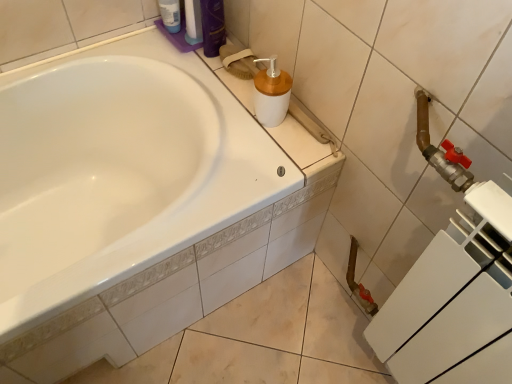
Describe the element at coordinates (271, 93) in the screenshot. The image size is (512, 384). I see `white matte plastic soap dispenser at upper center` at that location.

You are a GUI agent. You are given a task and a screenshot of the screen. Output one action in this format:
    pyautogui.click(x=<x>, y=<y>)
    Task: Click on the translucent plastic bottle at upper left, the second toiletry positioned from the right
    
    Given the screenshot: What is the action you would take?
    pyautogui.click(x=170, y=15)

From the image's perspective, which is above, white matte plastic soap dispenser at upper center or translucent plastic bottle at upper left, the first toiletry when ordered from left to right?

translucent plastic bottle at upper left, the first toiletry when ordered from left to right, is shown above in the image.

Looking at their sizes, would you say white matte plastic soap dispenser at upper center is wider or thinner than translucent plastic bottle at upper left, the first toiletry when ordered from left to right?

Clearly, white matte plastic soap dispenser at upper center has more width compared to translucent plastic bottle at upper left, the first toiletry when ordered from left to right.

Is white matte plastic soap dispenser at upper center to the right of translucent plastic bottle at upper left, the second toiletry positioned from the right, from the viewer's perspective?

Correct, you'll find white matte plastic soap dispenser at upper center to the right of translucent plastic bottle at upper left, the second toiletry positioned from the right.

Consider the image. Is white matte plastic soap dispenser at upper center beside translucent plastic bottle at upper left, the first toiletry when ordered from left to right?

No, white matte plastic soap dispenser at upper center is not making contact with translucent plastic bottle at upper left, the first toiletry when ordered from left to right.

Would you consider white matte plastic soap dispenser at upper center to be distant from shiny purple bottle at upper center, positioned as the second toiletry in left-to-right order?

Actually, white matte plastic soap dispenser at upper center and shiny purple bottle at upper center, positioned as the second toiletry in left-to-right order, are a little close together.

Is white matte plastic soap dispenser at upper center wider than shiny purple bottle at upper center, positioned as the second toiletry in left-to-right order?

Yes, white matte plastic soap dispenser at upper center is wider than shiny purple bottle at upper center, positioned as the second toiletry in left-to-right order.

Is point (260, 79) in front of point (207, 49)?

Yes, it is in front of point (207, 49).

Can you tell me how much white matte plastic soap dispenser at upper center and shiny purple bottle at upper center, positioned as the second toiletry in left-to-right order, differ in facing direction?

The angle between the facing direction of white matte plastic soap dispenser at upper center and the facing direction of shiny purple bottle at upper center, positioned as the second toiletry in left-to-right order, is 0.00205 degrees.

From a real-world perspective, between shiny purple bottle at upper center, which is the 1th toiletry from right to left, and translucent plastic bottle at upper left, the second toiletry positioned from the right, who is vertically lower?

translucent plastic bottle at upper left, the second toiletry positioned from the right.

Could you tell me if shiny purple bottle at upper center, positioned as the second toiletry in left-to-right order, is facing translucent plastic bottle at upper left, the second toiletry positioned from the right?

No, shiny purple bottle at upper center, positioned as the second toiletry in left-to-right order, is not facing towards translucent plastic bottle at upper left, the second toiletry positioned from the right.

Which is closer to the camera, (207, 29) or (174, 20)?

The point (207, 29) is closer.

Is shiny purple bottle at upper center, positioned as the second toiletry in left-to-right order, wider than translucent plastic bottle at upper left, the second toiletry positioned from the right?

Correct, the width of shiny purple bottle at upper center, positioned as the second toiletry in left-to-right order, exceeds that of translucent plastic bottle at upper left, the second toiletry positioned from the right.

Looking at this image, is translucent plastic bottle at upper left, the second toiletry positioned from the right, in front of shiny purple bottle at upper center, which is the 1th toiletry from right to left?

That is False.

Which is more distant, (160, 2) or (206, 29)?

Point (160, 2)

This screenshot has height=384, width=512. What are the coordinates of `toiletry lying behind the shiny purple bottle at upper center, positioned as the second toiletry in left-to-right order` in the screenshot? It's located at (170, 15).

Which of these two, translucent plastic bottle at upper left, the second toiletry positioned from the right, or shiny purple bottle at upper center, positioned as the second toiletry in left-to-right order, is bigger?

Bigger between the two is shiny purple bottle at upper center, positioned as the second toiletry in left-to-right order.

From a real-world perspective, is shiny purple bottle at upper center, positioned as the second toiletry in left-to-right order, below white matte plastic soap dispenser at upper center?

No, from a real-world perspective, shiny purple bottle at upper center, positioned as the second toiletry in left-to-right order, is not beneath white matte plastic soap dispenser at upper center.

Can you confirm if shiny purple bottle at upper center, positioned as the second toiletry in left-to-right order, is wider than white matte plastic soap dispenser at upper center?

No, shiny purple bottle at upper center, positioned as the second toiletry in left-to-right order, is not wider than white matte plastic soap dispenser at upper center.

Is shiny purple bottle at upper center, which is the 1th toiletry from right to left, positioned behind white matte plastic soap dispenser at upper center?

Yes, the depth of shiny purple bottle at upper center, which is the 1th toiletry from right to left, is greater than that of white matte plastic soap dispenser at upper center.

Does shiny purple bottle at upper center, positioned as the second toiletry in left-to-right order, touch white matte plastic soap dispenser at upper center?

shiny purple bottle at upper center, positioned as the second toiletry in left-to-right order, and white matte plastic soap dispenser at upper center are not in contact.

From the image's perspective, is translucent plastic bottle at upper left, the first toiletry when ordered from left to right, beneath white matte plastic soap dispenser at upper center?

Actually, translucent plastic bottle at upper left, the first toiletry when ordered from left to right, appears above white matte plastic soap dispenser at upper center in the image.

Are translucent plastic bottle at upper left, the second toiletry positioned from the right, and white matte plastic soap dispenser at upper center far apart?

No, translucent plastic bottle at upper left, the second toiletry positioned from the right, is not far from white matte plastic soap dispenser at upper center.

Is point (159, 6) positioned after point (260, 90)?

Yes.

Image resolution: width=512 pixels, height=384 pixels. What are the coordinates of `the 2nd toiletry above the white matte plastic soap dispenser at upper center (from the image's perspective)` in the screenshot? It's located at (170, 15).

From the white matte plastic soap dispenser at upper center, count the 1st toiletry to the left and point to it. Please provide its 2D coordinates.

[(213, 26)]

Estimate the real-world distances between objects in this image. Which object is closer to translucent plastic bottle at upper left, the second toiletry positioned from the right, white matte plastic soap dispenser at upper center or shiny purple bottle at upper center, which is the 1th toiletry from right to left?

Among the two, shiny purple bottle at upper center, which is the 1th toiletry from right to left, is located nearer to translucent plastic bottle at upper left, the second toiletry positioned from the right.

Based on their spatial positions, is white matte plastic soap dispenser at upper center or translucent plastic bottle at upper left, the second toiletry positioned from the right, closer to shiny purple bottle at upper center, positioned as the second toiletry in left-to-right order?

translucent plastic bottle at upper left, the second toiletry positioned from the right.

Based on their spatial positions, is shiny purple bottle at upper center, positioned as the second toiletry in left-to-right order, or translucent plastic bottle at upper left, the second toiletry positioned from the right, further from white matte plastic soap dispenser at upper center?

The object further to white matte plastic soap dispenser at upper center is translucent plastic bottle at upper left, the second toiletry positioned from the right.

Considering their positions, is translucent plastic bottle at upper left, the first toiletry when ordered from left to right, positioned further to white matte plastic soap dispenser at upper center than shiny purple bottle at upper center, positioned as the second toiletry in left-to-right order?

translucent plastic bottle at upper left, the first toiletry when ordered from left to right, is positioned further to the anchor white matte plastic soap dispenser at upper center.

Which object lies further to the anchor point translucent plastic bottle at upper left, the second toiletry positioned from the right, shiny purple bottle at upper center, which is the 1th toiletry from right to left, or white matte plastic soap dispenser at upper center?

white matte plastic soap dispenser at upper center.

Looking at the image, which one is located further to shiny purple bottle at upper center, positioned as the second toiletry in left-to-right order, translucent plastic bottle at upper left, the second toiletry positioned from the right, or white matte plastic soap dispenser at upper center?

The object further to shiny purple bottle at upper center, positioned as the second toiletry in left-to-right order, is white matte plastic soap dispenser at upper center.

Find the location of a particular element. The width and height of the screenshot is (512, 384). toiletry between translucent plastic bottle at upper left, the first toiletry when ordered from left to right, and white matte plastic soap dispenser at upper center, in the vertical direction is located at coordinates (213, 26).